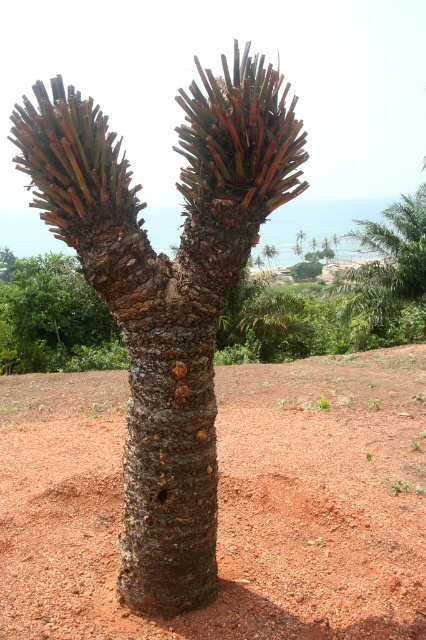
Does brown soil at center appear over brown rough bark tree at center?

Actually, brown soil at center is below brown rough bark tree at center.

Is brown soil at center taller than brown rough bark tree at center?

Incorrect, brown soil at center's height is not larger of brown rough bark tree at center's.

Is point (304, 614) closer to camera compared to point (111, 360)?

Yes.

Find the location of a particular element. The width and height of the screenshot is (426, 640). brown soil at center is located at coordinates (227, 502).